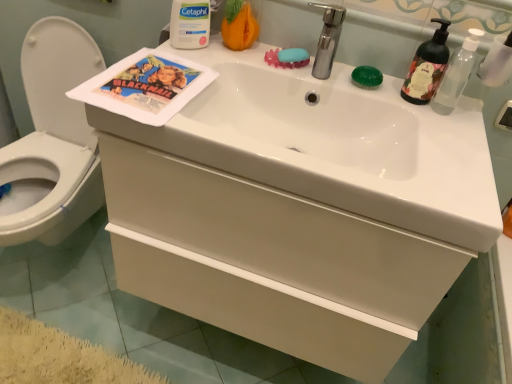
Question: Should I look upward or downward to see blue matte soap at upper center, which is the second soap from right to left?

Choices:
 (A) up
 (B) down

Answer: (A)

Question: Considering the relative sizes of blue matte soap at upper center, which is the second soap from right to left, and translucent plastic pump bottle at upper right in the image provided, is blue matte soap at upper center, which is the second soap from right to left, smaller than translucent plastic pump bottle at upper right?

Choices:
 (A) yes
 (B) no

Answer: (A)

Question: Would you say blue matte soap at upper center, which is the second soap from right to left, is outside translucent plastic pump bottle at upper right?

Choices:
 (A) yes
 (B) no

Answer: (A)

Question: Can you confirm if blue matte soap at upper center, which is the second soap from right to left, is shorter than translucent plastic pump bottle at upper right?

Choices:
 (A) yes
 (B) no

Answer: (A)

Question: Is blue matte soap at upper center, the first soap positioned from the left, taller than translucent plastic pump bottle at upper right?

Choices:
 (A) no
 (B) yes

Answer: (A)

Question: From a real-world perspective, is blue matte soap at upper center, which is the second soap from right to left, under translucent plastic pump bottle at upper right?

Choices:
 (A) no
 (B) yes

Answer: (B)

Question: From the image's perspective, is blue matte soap at upper center, which is the second soap from right to left, under translucent plastic pump bottle at upper right?

Choices:
 (A) yes
 (B) no

Answer: (B)

Question: Does silver metallic faucet at upper center have a greater height compared to white glossy sink at center?

Choices:
 (A) yes
 (B) no

Answer: (A)

Question: Is the depth of silver metallic faucet at upper center less than that of white glossy sink at center?

Choices:
 (A) no
 (B) yes

Answer: (A)

Question: Does silver metallic faucet at upper center come behind white glossy sink at center?

Choices:
 (A) no
 (B) yes

Answer: (B)

Question: Can you confirm if silver metallic faucet at upper center is bigger than white glossy sink at center?

Choices:
 (A) yes
 (B) no

Answer: (B)

Question: Is silver metallic faucet at upper center aimed at white glossy sink at center?

Choices:
 (A) no
 (B) yes

Answer: (A)

Question: Is silver metallic faucet at upper center looking in the opposite direction of white glossy sink at center?

Choices:
 (A) yes
 (B) no

Answer: (B)

Question: Is white glossy toilet at left at the left side of white matte drawer at center?

Choices:
 (A) yes
 (B) no

Answer: (A)